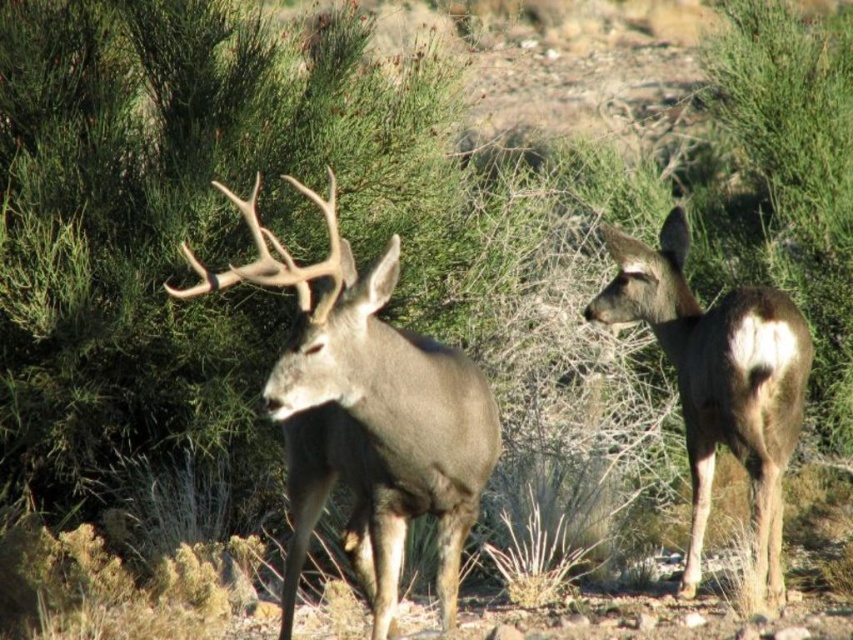
From the picture: You are a wildlife photographer aiming to capture a closeup shot of the brown velvet deer at center. You have a camera with a 100mm lens that can focus as close as 1 meter. Can you get a clear closeup without moving closer than 1 meter?

The brown velvet deer at center is 3.68 meters away. Since the camera can focus as close as 1 meter, you can get a clear closeup without moving closer than 1 meter because the distance is within the lens capability.

You are a wildlife photographer aiming to capture both the brown velvet deer at center and the brown fur deer at right in a single frame. Based on their positions, which deer should you focus on first to ensure both are in the shot?

The brown velvet deer at center is located above the brown fur deer at right, so you should focus on the brown velvet deer at center first to ensure both are in the shot.

You are standing in the desert and see the brown velvet deer at center. If you want to approach it directly from the north, which direction should you move relative to the deer?

Since the deer is at the center of the image, moving directly south would bring you closer to it from the north. However, the exact direction depends on the deer being at coordinates (367, 416), so moving towards that point from the north would require heading south.